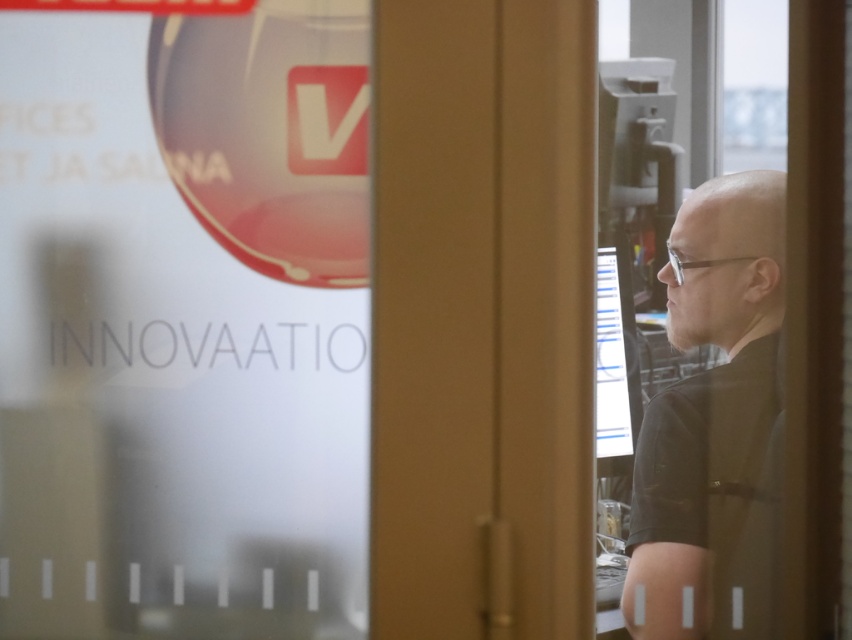
You are a GUI agent. You are given a task and a screenshot of the screen. Output one action in this format:
    pyautogui.click(x=<x>, y=<y>)
    Task: Click on the black matte shirt at right
    The width and height of the screenshot is (852, 640).
    Given the screenshot: What is the action you would take?
    pyautogui.click(x=711, y=419)

Between black matte shirt at right and matte black monitor at center, which one is positioned higher?

Positioned higher is matte black monitor at center.

Image resolution: width=852 pixels, height=640 pixels. Identify the location of black matte shirt at right. (711, 419).

Where is `black matte shirt at right`? The height and width of the screenshot is (640, 852). black matte shirt at right is located at coordinates (711, 419).